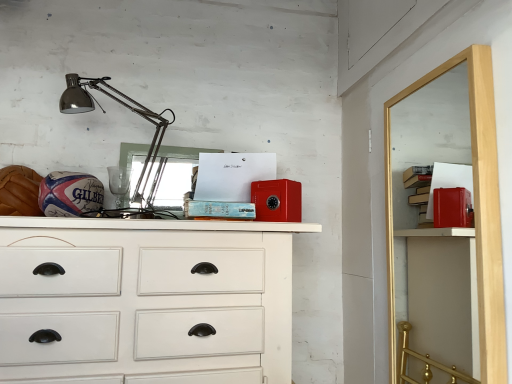
Question: From their relative heights in the image, would you say red matte safe at upper right is taller or shorter than white painted wood chest of drawers at center?

Choices:
 (A) short
 (B) tall

Answer: (B)

Question: Considering the positions of red matte safe at upper right and white painted wood chest of drawers at center in the image, is red matte safe at upper right bigger or smaller than white painted wood chest of drawers at center?

Choices:
 (A) small
 (B) big

Answer: (A)

Question: Considering the real-world distances, which object is closest to the white painted wood chest of drawers at center?

Choices:
 (A) red matte safe at upper right
 (B) metallic silver lamp at upper left

Answer: (B)

Question: Which object is the farthest from the red matte safe at upper right?

Choices:
 (A) metallic silver lamp at upper left
 (B) white painted wood chest of drawers at center

Answer: (A)